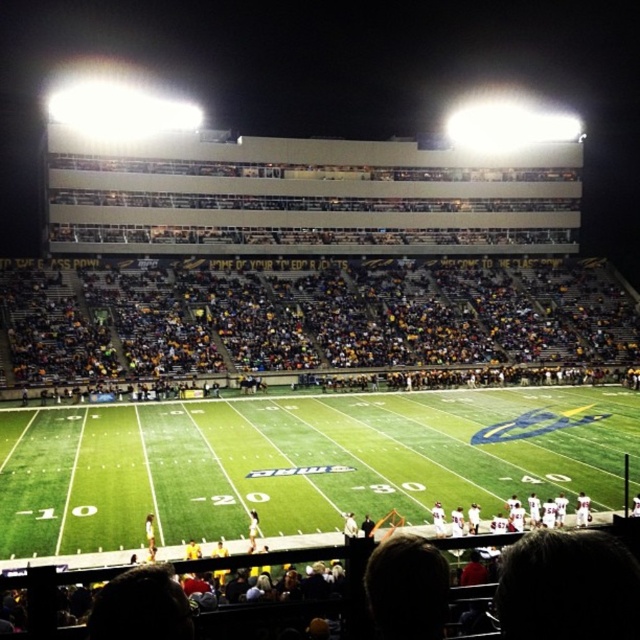
Which is more to the left, green turf football field at center or yellow fabric seats at lower center?

From the viewer's perspective, green turf football field at center appears more on the left side.

Is point (589, 408) in front of point (125, 324)?

Yes, it is.

The width and height of the screenshot is (640, 640). What are the coordinates of `green turf football field at center` in the screenshot? It's located at (301, 461).